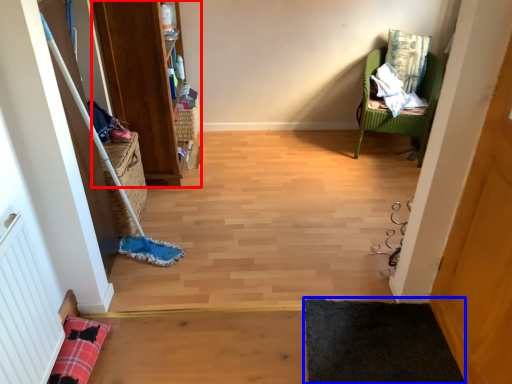
Question: Which object appears farthest to the camera in this image, bookshelf (highlighted by a red box) or yoga mat (highlighted by a blue box)?

Choices:
 (A) bookshelf
 (B) yoga mat

Answer: (A)